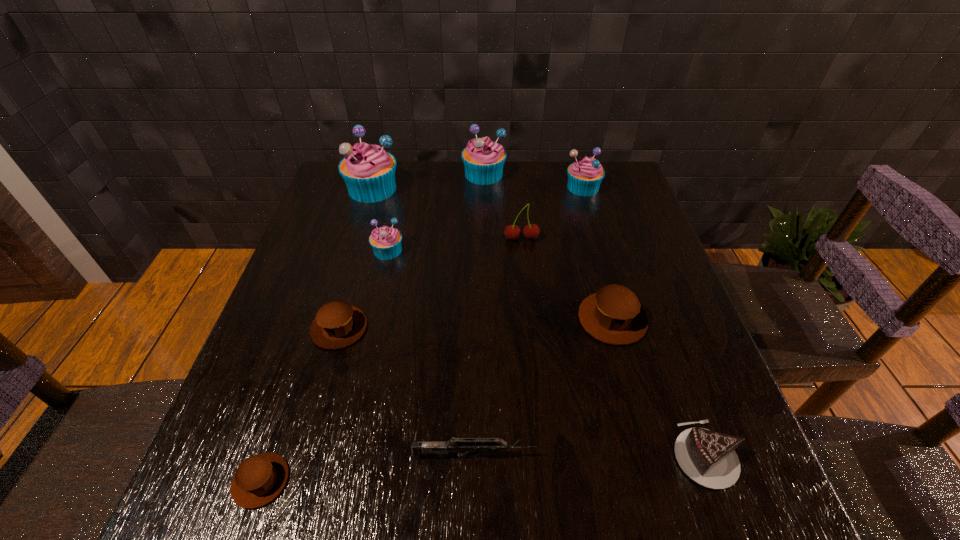
The image size is (960, 540). I want to click on object at the far right corner, so click(x=585, y=175).

You are a GUI agent. You are given a task and a screenshot of the screen. Output one action in this format:
    pyautogui.click(x=<x>, y=<y>)
    Task: Click on the object that is positioned at the near right corner
    
    Given the screenshot: What is the action you would take?
    pyautogui.click(x=708, y=457)

Identify the location of free space at the far edge of the desktop. The image size is (960, 540). (461, 175).

Locate an element on the screen. This screenshot has height=540, width=960. vacant area at the near edge of the desktop is located at coordinates (361, 510).

Find the location of a particular element. The height and width of the screenshot is (540, 960). free spot at the left edge of the desktop is located at coordinates pos(269,357).

In the image, there is a desktop. Where is `vacant region at the right edge`? The image size is (960, 540). vacant region at the right edge is located at coordinates (640, 303).

In the image, there is a desktop. In order to click on vacant space at the far left corner in this screenshot , I will do `click(329, 205)`.

In the image, there is a desktop. What are the coordinates of `free region at the far right corner` in the screenshot? It's located at pyautogui.click(x=601, y=196).

I want to click on vacant area that lies between the gun and the cherry, so click(497, 347).

Find the location of a particular element. The image size is (960, 540). vacant space that is in between the fifth muffin from left to right and the second smallest brown muffin is located at coordinates (412, 251).